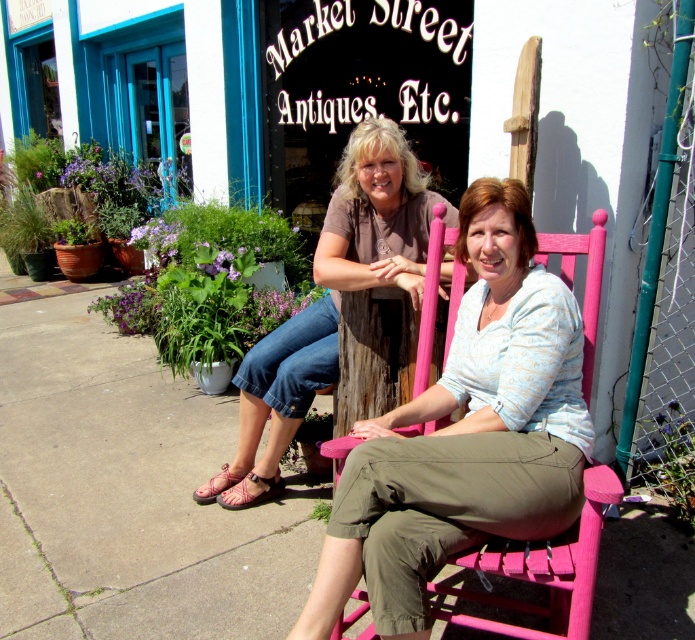
Question: Is matte brown shirt at center behind pink painted wood rocking chair at center?

Choices:
 (A) yes
 (B) no

Answer: (A)

Question: Among these points, which one is farthest from the camera?

Choices:
 (A) (359, 216)
 (B) (573, 563)

Answer: (A)

Question: Does matte brown shirt at center have a smaller size compared to pink painted wood rocking chair at center?

Choices:
 (A) yes
 (B) no

Answer: (B)

Question: Is matte brown shirt at center thinner than pink painted wood rocking chair at center?

Choices:
 (A) no
 (B) yes

Answer: (A)